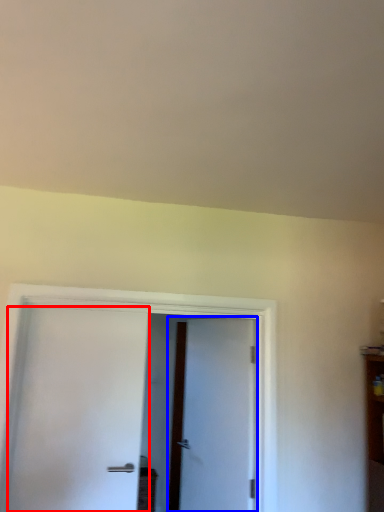
Question: Which point is further to the camera, door (highlighted by a red box) or door (highlighted by a blue box)?

Choices:
 (A) door
 (B) door

Answer: (B)